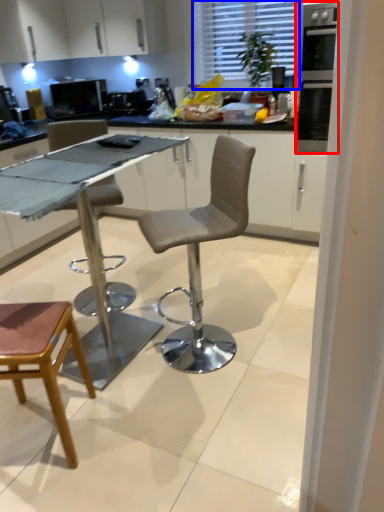
Question: Which object is further to the camera taking this photo, oven (highlighted by a red box) or window (highlighted by a blue box)?

Choices:
 (A) oven
 (B) window

Answer: (B)